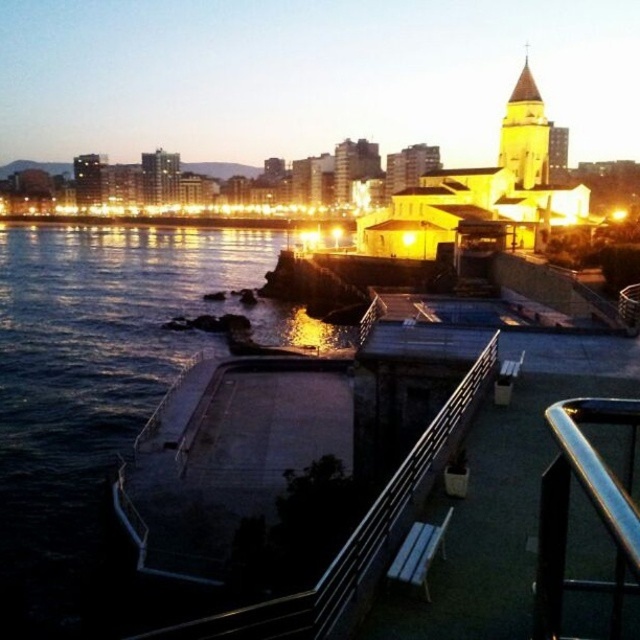
Measure the distance between golden stone tower at upper right and camera.

golden stone tower at upper right is 99.29 meters away from camera.

Which is in front, point (538, 128) or point (426, 579)?

Positioned in front is point (426, 579).

What do you see at coordinates (524, 132) in the screenshot? This screenshot has height=640, width=640. I see `golden stone tower at upper right` at bounding box center [524, 132].

Locate an element on the screen. Image resolution: width=640 pixels, height=640 pixels. golden stone tower at upper right is located at coordinates (524, 132).

Is metallic silver rail at center bigger than golden stone tower at upper right?

Yes.

Who is shorter, metallic silver rail at center or golden stone tower at upper right?

With less height is metallic silver rail at center.

Between point (376, 550) and point (516, 81), which one is positioned behind?

The point (516, 81) is behind.

Find the location of a particular element. metallic silver rail at center is located at coordinates (394, 509).

Is dark blue water at lower left to the left of golden stone tower at upper right from the viewer's perspective?

Indeed, dark blue water at lower left is positioned on the left side of golden stone tower at upper right.

Between dark blue water at lower left and golden stone tower at upper right, which one appears on the right side from the viewer's perspective?

Positioned to the right is golden stone tower at upper right.

Image resolution: width=640 pixels, height=640 pixels. Describe the element at coordinates (100, 392) in the screenshot. I see `dark blue water at lower left` at that location.

The width and height of the screenshot is (640, 640). In order to click on dark blue water at lower left in this screenshot , I will do `click(100, 392)`.